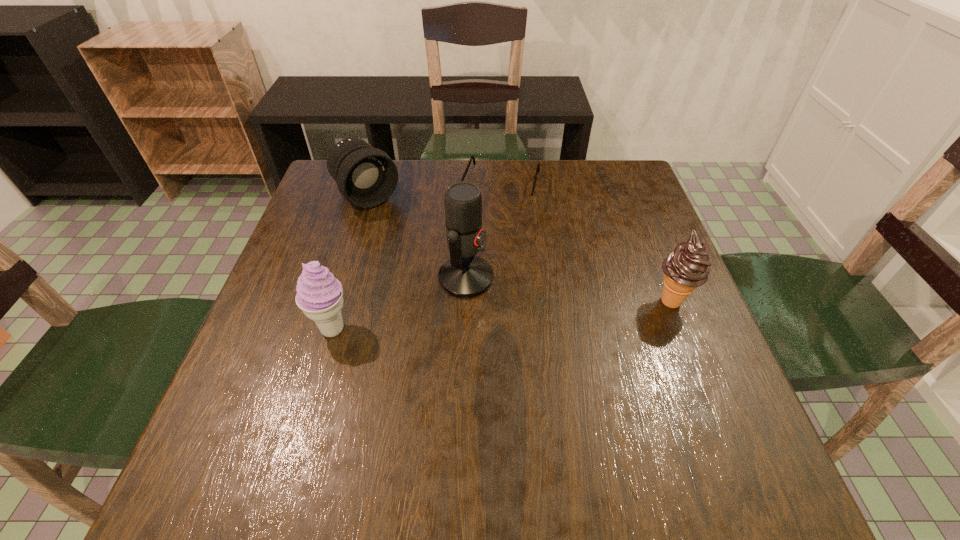
Find the location of a particular element. object present at the right edge is located at coordinates (687, 267).

The height and width of the screenshot is (540, 960). Identify the location of object located at the far left corner. (366, 177).

The image size is (960, 540). I want to click on free space at the far edge, so click(527, 173).

Find the location of a particular element. The width and height of the screenshot is (960, 540). free region at the near edge of the desktop is located at coordinates (337, 417).

Image resolution: width=960 pixels, height=540 pixels. In the image, there is a desktop. Find the location of `free region at the left edge`. free region at the left edge is located at coordinates (287, 328).

The width and height of the screenshot is (960, 540). What are the coordinates of `free space at the right edge of the desktop` in the screenshot? It's located at (628, 302).

You are a GUI agent. You are given a task and a screenshot of the screen. Output one action in this format:
    pyautogui.click(x=<x>, y=<y>)
    Task: Click on the blank space at the near left corner of the desktop
    The image size is (960, 540).
    Given the screenshot: What is the action you would take?
    pyautogui.click(x=233, y=397)

I want to click on free space at the near right corner of the desktop, so click(x=677, y=406).

Where is `vacant area that lies between the spectacles and the fourth tallest object`? The image size is (960, 540). vacant area that lies between the spectacles and the fourth tallest object is located at coordinates (434, 193).

Identify the location of free space that is in between the spectacles and the left icecream. (417, 259).